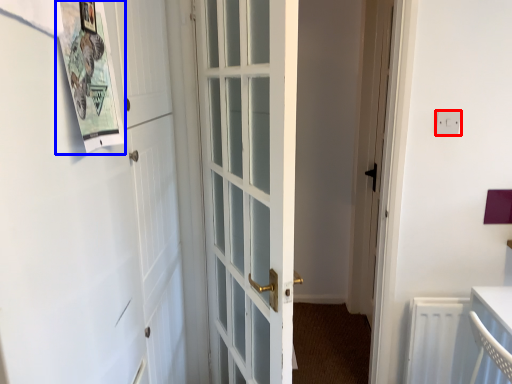
Question: Which of the following is the closest to the observer, electric outlet (highlighted by a red box) or bulletin board (highlighted by a blue box)?

Choices:
 (A) electric outlet
 (B) bulletin board

Answer: (B)